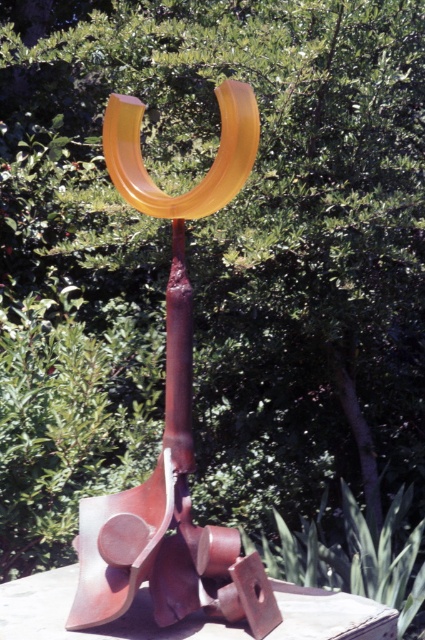
You are standing in front of the matte yellow metal sculpture at center. You want to take a photo of it with your smartphone. Your phone has a maximum focus range of 5 feet. Will you be able to focus on the sculpture?

The matte yellow metal sculpture at center and camera are 5.70 feet apart from each other. Since the maximum focus range is 5 feet, the camera cannot focus on the sculpture as it is beyond the 5 feet limit.

What are the coordinates of the matte yellow metal sculpture at center?

The coordinates of the matte yellow metal sculpture at center are at point [172,419].

You are an art installer who needs to place a new decorative item between the rusty metal sculpture at center and the translucent amber horseshoe at center. The decorative item is 30 inches long. Will it fit in the space between them?

The rusty metal sculpture at center and translucent amber horseshoe at center are 33.18 inches apart. Since the decorative item is 30 inches long, it will fit in the space between them as 30 inches is shorter than 33.18 inches.